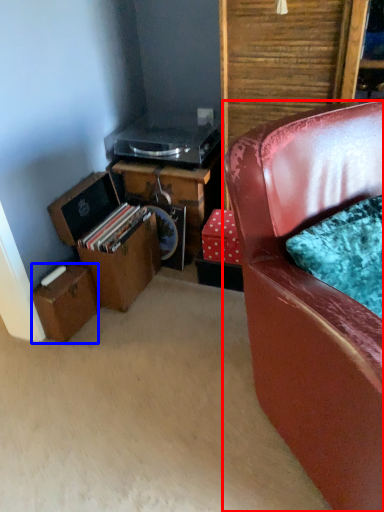
Question: Which point is closer to the camera, chair (highlighted by a red box) or box (highlighted by a blue box)?

Choices:
 (A) chair
 (B) box

Answer: (A)